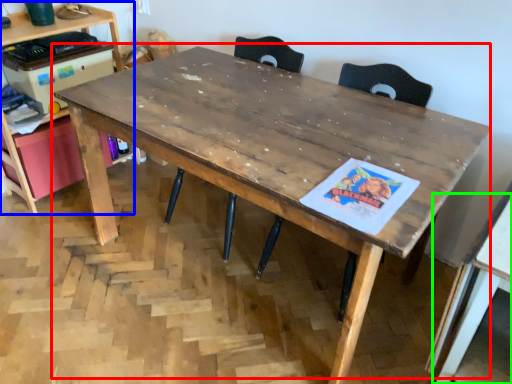
Question: Which object is positioned closest to table (highlighted by a red box)? Select from computer desk (highlighted by a blue box) and table (highlighted by a green box).

Choices:
 (A) computer desk
 (B) table

Answer: (B)